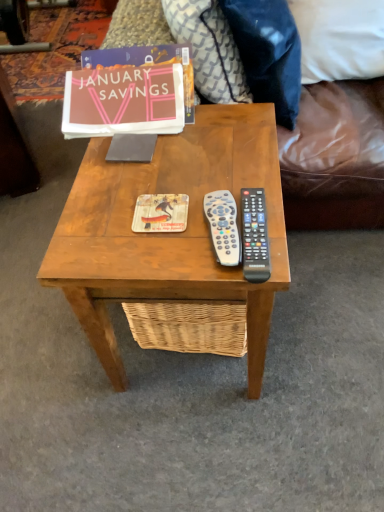
This screenshot has width=384, height=512. Find the location of `free space in front of wooden coffee table at center`. free space in front of wooden coffee table at center is located at coordinates (214, 449).